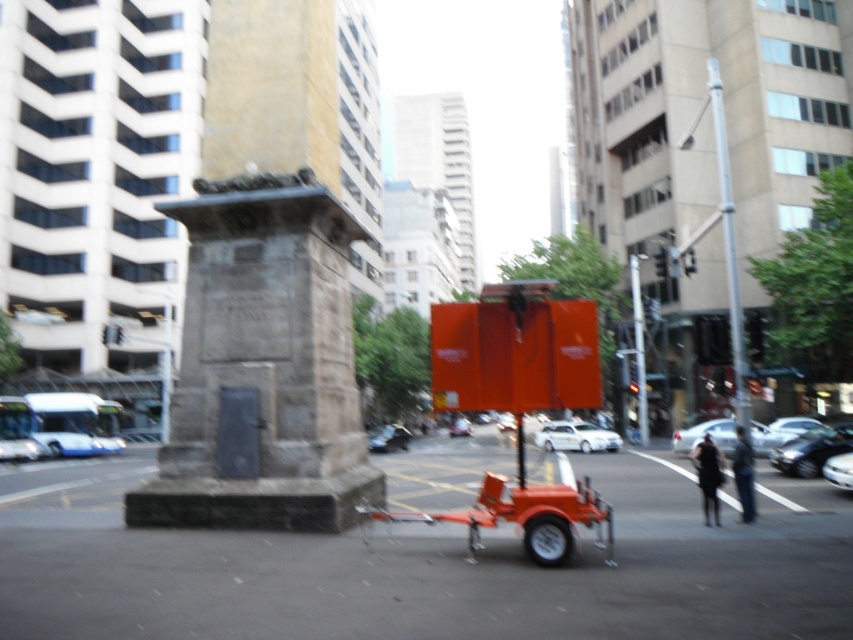
Does point (769, 445) lie behind point (457, 433)?

No, it is not.

Does point (729, 452) come closer to viewer compared to point (463, 422)?

Yes, it is.

Between point (734, 420) and point (454, 424), which one is positioned in front?

Point (734, 420) is in front.

You are a GUI agent. You are given a task and a screenshot of the screen. Output one action in this format:
    pyautogui.click(x=<x>, y=<y>)
    Task: Click on the silver metallic sedan at center
    This screenshot has height=640, width=853.
    Given the screenshot: What is the action you would take?
    pyautogui.click(x=704, y=433)

Can you confirm if shiny silver sedan at lower right is wider than metallic silver car at center?

No, shiny silver sedan at lower right is not wider than metallic silver car at center.

Does shiny silver sedan at lower right have a greater height compared to metallic silver car at center?

Incorrect, shiny silver sedan at lower right's height is not larger of metallic silver car at center's.

The height and width of the screenshot is (640, 853). Describe the element at coordinates (839, 470) in the screenshot. I see `shiny silver sedan at lower right` at that location.

Find the location of a particular element. Image resolution: width=853 pixels, height=640 pixels. shiny silver sedan at lower right is located at coordinates 839,470.

Does point (799, 449) lie behind point (718, 444)?

No, it is not.

Identify the location of shiny black car at lower right. The width and height of the screenshot is (853, 640). (811, 449).

The height and width of the screenshot is (640, 853). What are the coordinates of `shiny black car at lower right` in the screenshot? It's located at (811, 449).